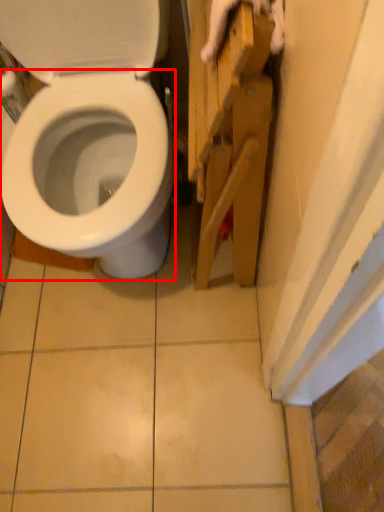
Question: Observing the image, what is the correct spatial positioning of bidet (annotated by the red box) in reference to cabinetry?

Choices:
 (A) left
 (B) right

Answer: (A)